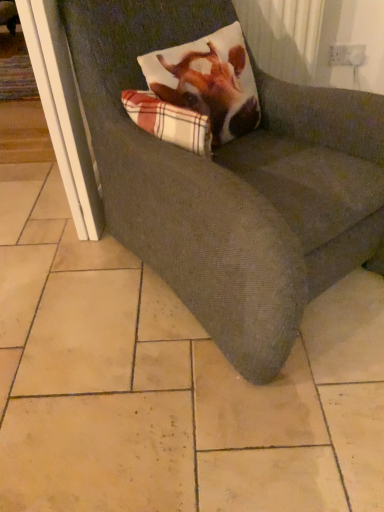
At what (x,y) coordinates should I click in order to perform the action: click on vacant area situated to the left side of textured gray couch at center. Please return your answer as a coordinate pair (x, y). The image size is (384, 512). Looking at the image, I should click on (55, 268).